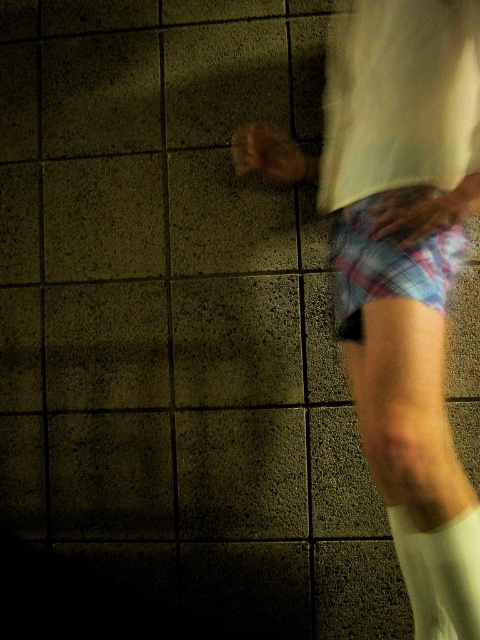
Question: Which point is farther to the camera?

Choices:
 (A) white soft sock at lower right
 (B) plaid shorts at right
 (C) white fabric shirt at upper right

Answer: (A)

Question: Considering the real-world distances, which object is closest to the white soft sock at lower right?

Choices:
 (A) plaid shorts at right
 (B) plaid fabric shorts at lower right
 (C) white fabric shirt at upper right

Answer: (A)

Question: Does white fabric shirt at upper right have a greater width compared to plaid fabric shorts at lower right?

Choices:
 (A) no
 (B) yes

Answer: (B)

Question: Is white fabric shirt at upper right wider than white soft sock at lower right?

Choices:
 (A) yes
 (B) no

Answer: (A)

Question: Estimate the real-world distances between objects in this image. Which object is farther from the white fabric shirt at upper right?

Choices:
 (A) white soft sock at lower right
 (B) plaid fabric shorts at lower right
 (C) plaid shorts at right

Answer: (A)

Question: From the image, what is the correct spatial relationship of white fabric shirt at upper right in relation to white soft sock at lower right?

Choices:
 (A) above
 (B) below

Answer: (A)